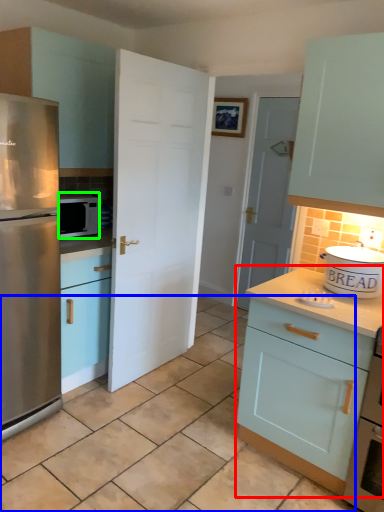
Question: Which object is the farthest from cabinetry (highlighted by a red box)? Choose among these: tile (highlighted by a blue box) or microwave oven (highlighted by a green box).

Choices:
 (A) tile
 (B) microwave oven

Answer: (B)